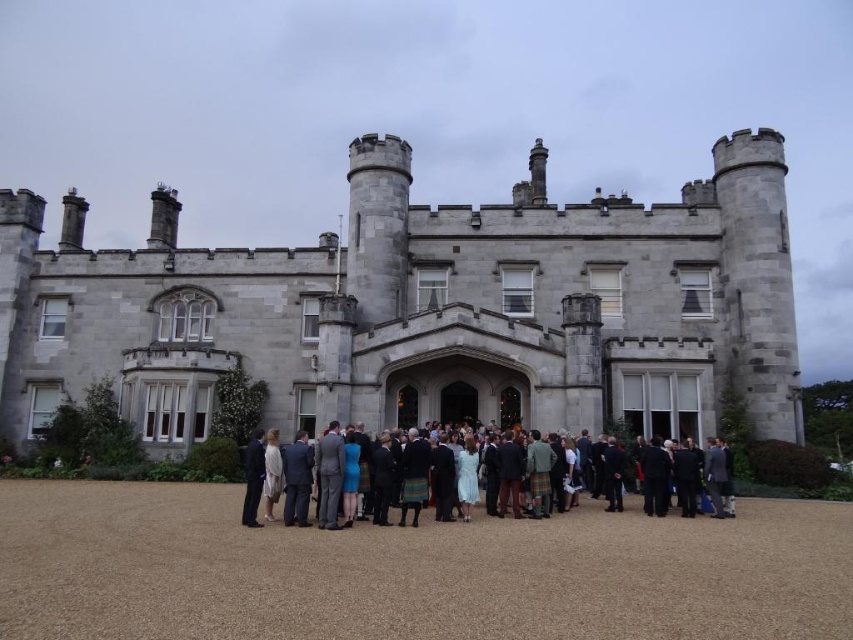
Question: Among these objects, which one is farthest from the camera?

Choices:
 (A) gray stone castle at center
 (B) matte black suit at center

Answer: (A)

Question: In this image, where is gray stone castle at center located relative to matte black suit at center?

Choices:
 (A) right
 (B) left

Answer: (B)

Question: Is gray stone castle at center to the right of matte black suit at center from the viewer's perspective?

Choices:
 (A) yes
 (B) no

Answer: (B)

Question: Is gray stone castle at center thinner than matte black suit at center?

Choices:
 (A) no
 (B) yes

Answer: (A)